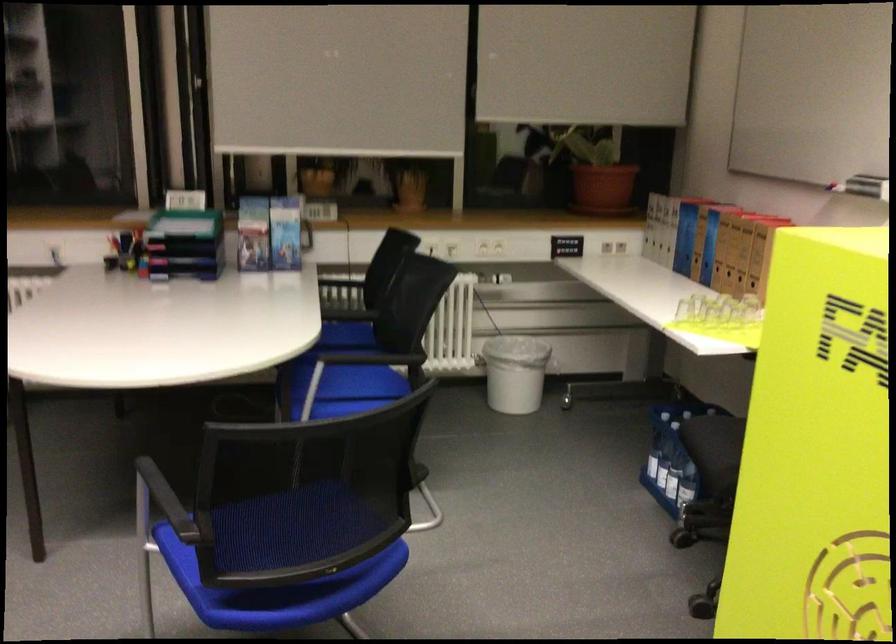
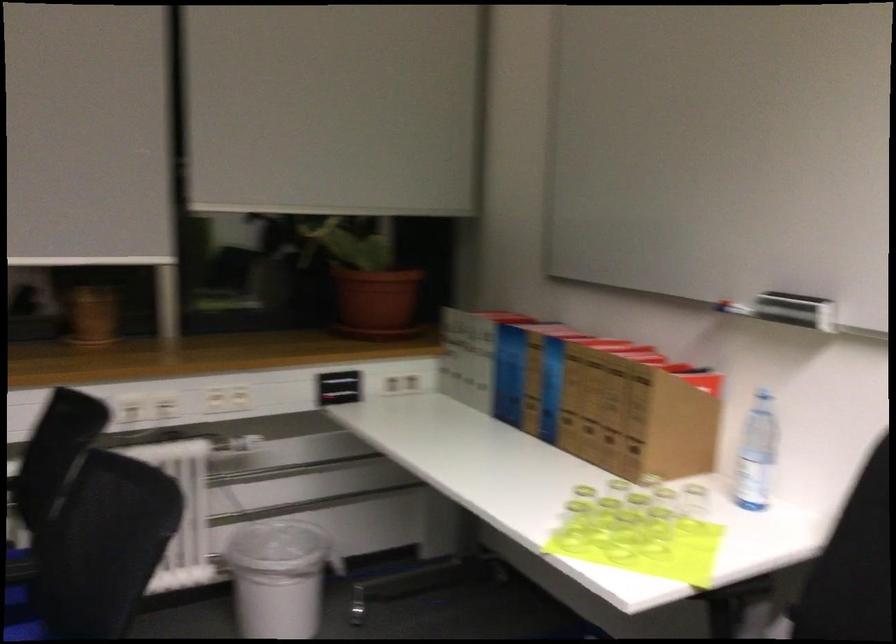
Where in the second image is the point corresponding to point (367, 343) from the first image?

(23, 603)